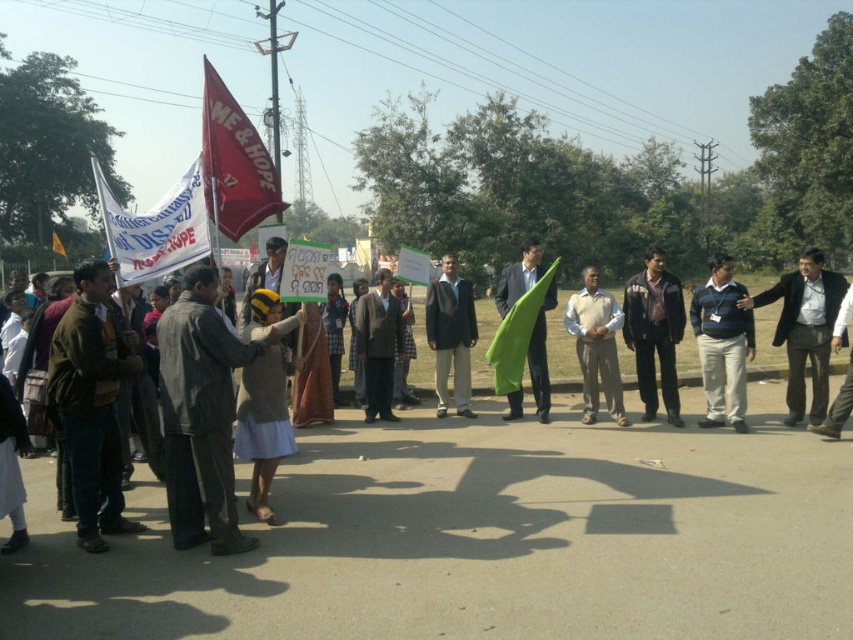
You are a photographer trying to capture a wide shot of the protest scene. You want to ensure both the striped fabric jacket at center and the red fabric flag at center are in the frame. Given their distance apart, what is the minimum focal length lens you should use to include both objects in your shot?

The striped fabric jacket at center and red fabric flag at center are 117.73 feet apart. To capture both in a single frame, you need a wide angle lens with a focal length of 35mm or lower, as longer focal lengths may not encompass the full distance between them.

You are a photographer at the protest scene. You want to capture a photo that includes both the dark gray suit at right and the dark brown suit at center. Which suit should you zoom in on to ensure both are clearly visible in the frame?

The dark gray suit at right is larger in size than dark brown suit at center, so you should zoom in on the dark gray suit at right to ensure both are clearly visible in the frame.

You are a photographer trying to capture a clear shot of both the striped fabric jacket at center and the red fabric flag at center. Given their sizes, which object should you focus on first to ensure it appears sharp in the photo?

The striped fabric jacket at center has a smaller size compared to the red fabric flag at center, so you should focus on the striped fabric jacket at center first to ensure its details are sharp before adjusting for the larger flag.